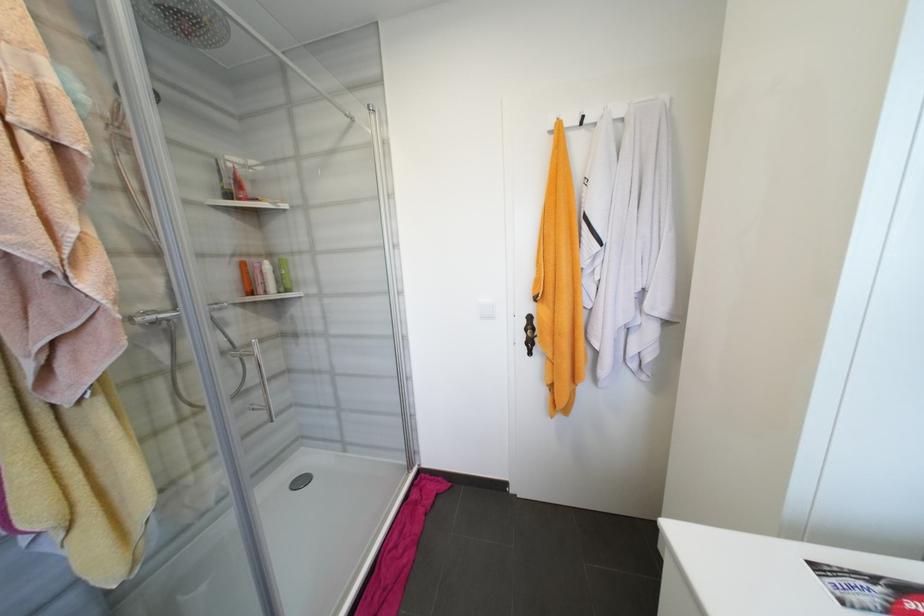
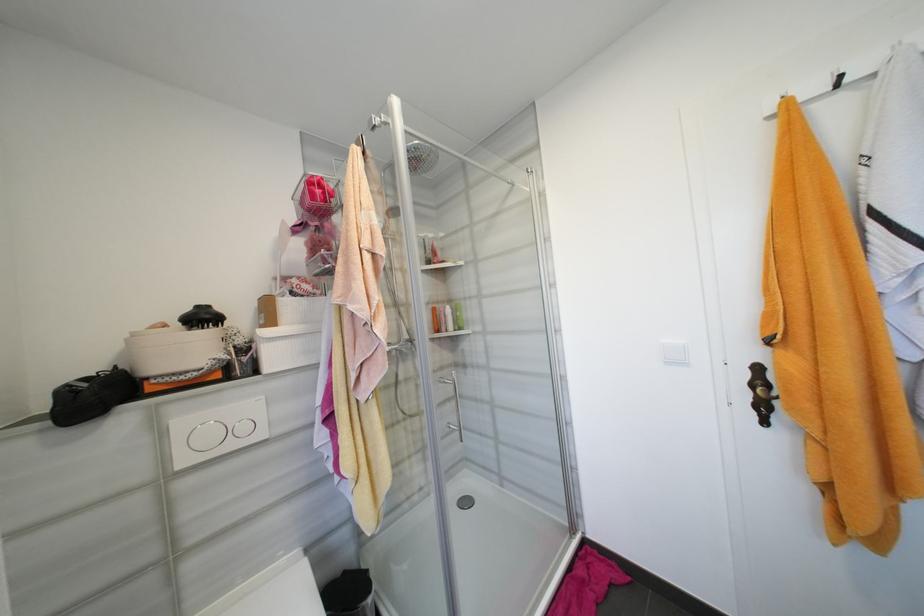
The point at (266, 292) is marked in the first image. Where is the corresponding point in the second image?

(450, 330)